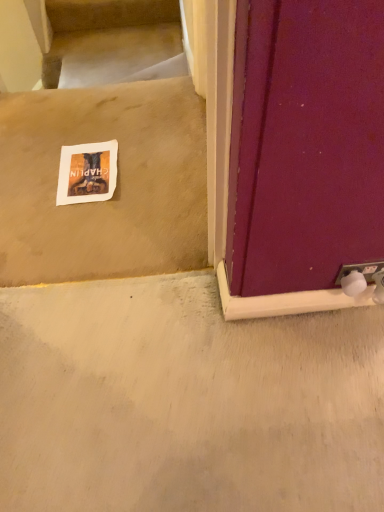
Question: Is beige carpet at upper left in contact with white paper at center?

Choices:
 (A) no
 (B) yes

Answer: (A)

Question: Is white paper at center at the back of beige carpet at upper left?

Choices:
 (A) yes
 (B) no

Answer: (B)

Question: From the image's perspective, is beige carpet at upper left beneath white paper at center?

Choices:
 (A) yes
 (B) no

Answer: (B)

Question: Does beige carpet at upper left have a larger size compared to white paper at center?

Choices:
 (A) yes
 (B) no

Answer: (A)

Question: Would you say beige carpet at upper left contains white paper at center?

Choices:
 (A) no
 (B) yes

Answer: (A)

Question: Is beige carpet at upper left facing towards white paper at center?

Choices:
 (A) yes
 (B) no

Answer: (B)

Question: Is white paper at center positioned beyond the bounds of beige carpet at upper left?

Choices:
 (A) yes
 (B) no

Answer: (A)

Question: Would you say white paper at center is a long distance from beige carpet at upper left?

Choices:
 (A) yes
 (B) no

Answer: (A)

Question: Is white paper at center smaller than beige carpet at upper left?

Choices:
 (A) yes
 (B) no

Answer: (A)

Question: From a real-world perspective, is white paper at center beneath beige carpet at upper left?

Choices:
 (A) no
 (B) yes

Answer: (A)

Question: Can you confirm if white paper at center is wider than beige carpet at upper left?

Choices:
 (A) yes
 (B) no

Answer: (B)

Question: From a real-world perspective, is white paper at center over beige carpet at upper left?

Choices:
 (A) yes
 (B) no

Answer: (A)

Question: Considering the positions of beige carpet at upper left and white paper at center in the image, is beige carpet at upper left taller or shorter than white paper at center?

Choices:
 (A) tall
 (B) short

Answer: (A)